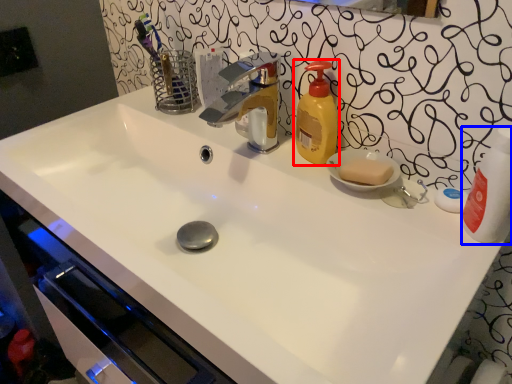
Question: Which object is further to the camera taking this photo, soap dispenser (highlighted by a red box) or cleaning product (highlighted by a blue box)?

Choices:
 (A) soap dispenser
 (B) cleaning product

Answer: (A)